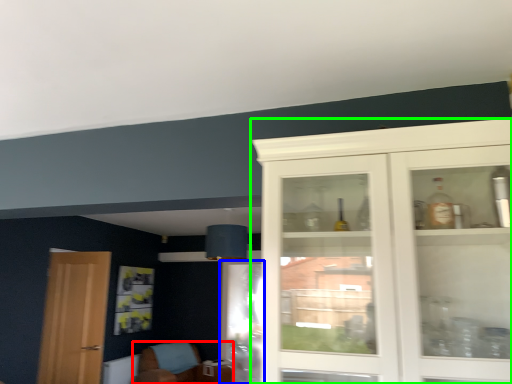
Question: Which is farther away from chair (highlighted by a red box)? screen door (highlighted by a blue box) or cabinetry (highlighted by a green box)?

Choices:
 (A) screen door
 (B) cabinetry

Answer: (B)